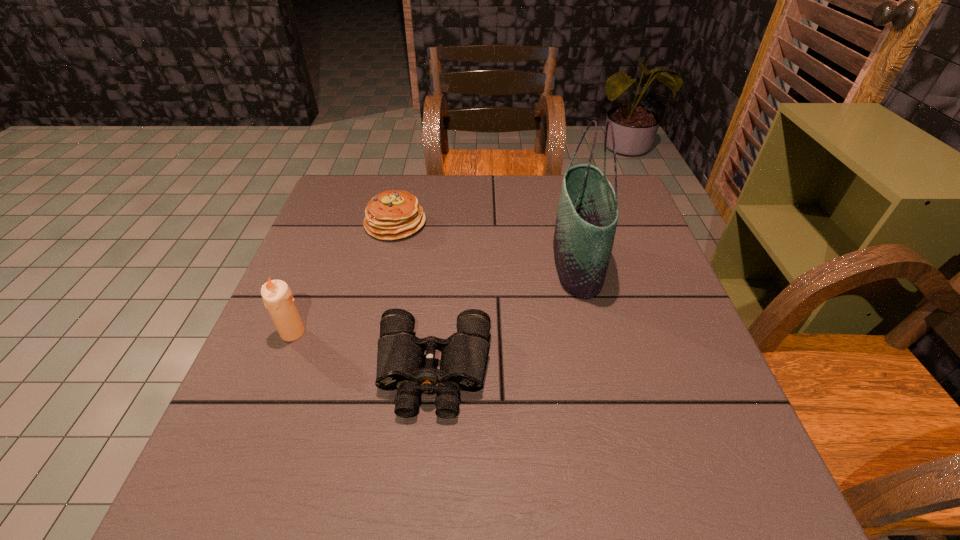
You are a GUI agent. You are given a task and a screenshot of the screen. Output one action in this format:
    pyautogui.click(x=<x>, y=<y>)
    Task: Click on the tote bag
    This screenshot has height=540, width=960.
    Given the screenshot: What is the action you would take?
    pyautogui.click(x=587, y=215)

What are the coordinates of `the rightmost object` in the screenshot? It's located at (587, 215).

I want to click on the third shortest object, so click(277, 297).

Locate an element on the screen. the leftmost object is located at coordinates (277, 297).

Locate an element on the screen. pancake is located at coordinates (391, 215).

The width and height of the screenshot is (960, 540). I want to click on binoculars, so click(x=400, y=354).

I want to click on free region located 0.190m on the front of the tallest object, so click(604, 373).

Find the location of a particular element. free spot located on the back of the candle is located at coordinates (320, 267).

In order to click on vacant space situated on the front of the pancake in this screenshot , I will do `click(378, 294)`.

Where is `free spot located 0.070m through the eyepieces of the binoculars`? The width and height of the screenshot is (960, 540). free spot located 0.070m through the eyepieces of the binoculars is located at coordinates (425, 460).